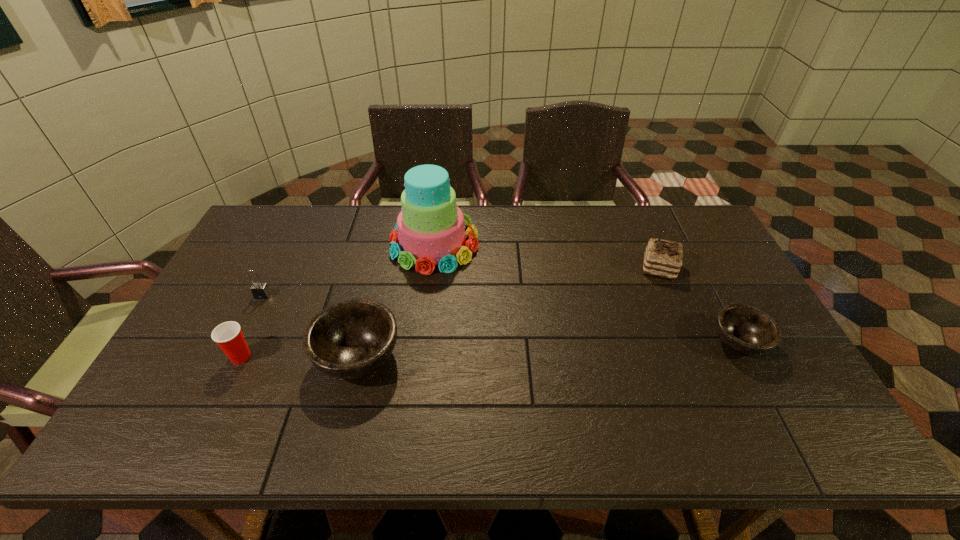
You are a GUI agent. You are given a task and a screenshot of the screen. Output one action in this format:
    pyautogui.click(x=<x>, y=<y>)
    Task: Click on the empty space between the chocolate cake and the tallest object
    The image size is (960, 540).
    Given the screenshot: What is the action you would take?
    pyautogui.click(x=547, y=256)

Image resolution: width=960 pixels, height=540 pixels. I want to click on vacant area that lies between the Dixie cup and the fourth nearest object, so click(252, 326).

Identify the location of free space between the Dixie cup and the right bowl. pyautogui.click(x=490, y=349).

Find the location of `vacant region between the cake and the shorter bowl`. vacant region between the cake and the shorter bowl is located at coordinates (587, 293).

Find the location of a particular element. free space between the Dixie cup and the padlock is located at coordinates (252, 326).

Where is `the third closest object to the taller bowl`? The width and height of the screenshot is (960, 540). the third closest object to the taller bowl is located at coordinates (260, 290).

What are the coordinates of `object that is the third closest to the right bowl` in the screenshot? It's located at (351, 338).

Where is `vacant space that satisfies the following two spatial constraints: 1. on the back side of the taller bowl; 2. on the right side of the Dixie cup`? The height and width of the screenshot is (540, 960). vacant space that satisfies the following two spatial constraints: 1. on the back side of the taller bowl; 2. on the right side of the Dixie cup is located at coordinates coord(241,356).

The image size is (960, 540). Identify the location of vacant space that satisfies the following two spatial constraints: 1. on the shackle of the padlock; 2. on the left side of the Dixie cup. (233, 357).

Where is `free space that satisfies the following two spatial constraints: 1. on the shackle of the Dixie cup; 2. on the left side of the fourth nearest object`? This screenshot has height=540, width=960. free space that satisfies the following two spatial constraints: 1. on the shackle of the Dixie cup; 2. on the left side of the fourth nearest object is located at coordinates (233, 357).